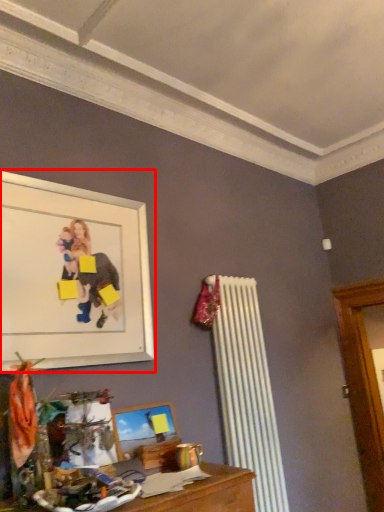
Question: Observing the image, what is the correct spatial positioning of picture frame (annotated by the red box) in reference to picture frame?

Choices:
 (A) right
 (B) left

Answer: (B)